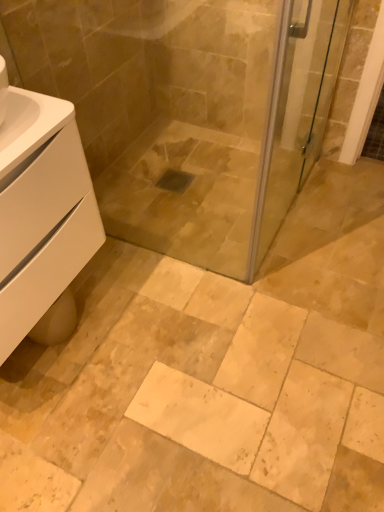
Find the location of `vacant area that lies in front of transparent glass screen door at upper right`. vacant area that lies in front of transparent glass screen door at upper right is located at coordinates (293, 296).